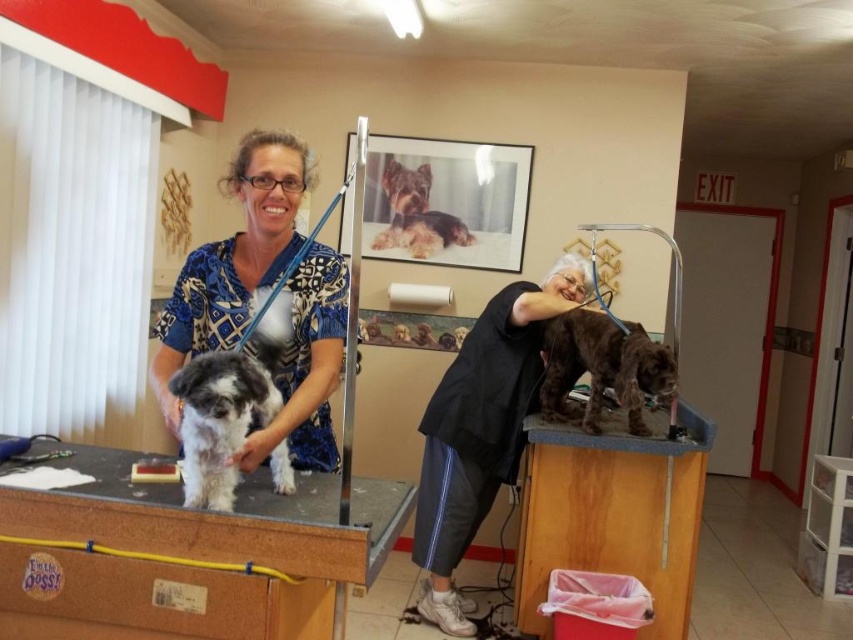
Question: Is blue printed scrubs at left above shiny brown fur at center?

Choices:
 (A) yes
 (B) no

Answer: (A)

Question: Estimate the real-world distances between objects in this image. Which object is closer to the black fabric at upper center?

Choices:
 (A) shiny brown fur at center
 (B) wooden table at lower right
 (C) wooden table at center
 (D) fluffy white fur at center

Answer: (A)

Question: Which object is the closest to the shiny brown fur at center?

Choices:
 (A) fluffy white fur at center
 (B) wooden table at center
 (C) black fabric at upper center
 (D) blue printed scrubs at left

Answer: (C)

Question: Which of the following is the closest to the observer?

Choices:
 (A) (229, 378)
 (B) (544, 304)
 (C) (563, 445)

Answer: (A)

Question: In this image, where is wooden table at lower right located relative to fluffy white fur at center?

Choices:
 (A) right
 (B) left

Answer: (A)

Question: Observing the image, what is the correct spatial positioning of black fabric at upper center in reference to fluffy white fur at center?

Choices:
 (A) left
 (B) right

Answer: (B)